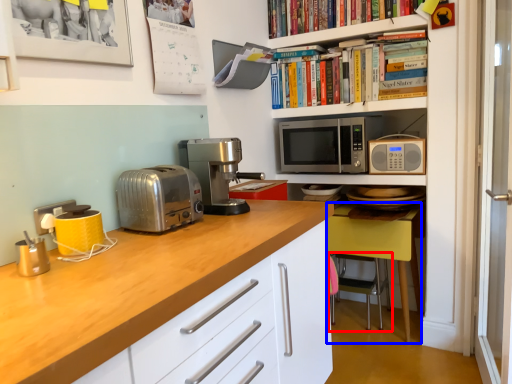
Question: Which object appears closest to the camera in this image, chair (highlighted by a red box) or chair (highlighted by a blue box)?

Choices:
 (A) chair
 (B) chair

Answer: (B)